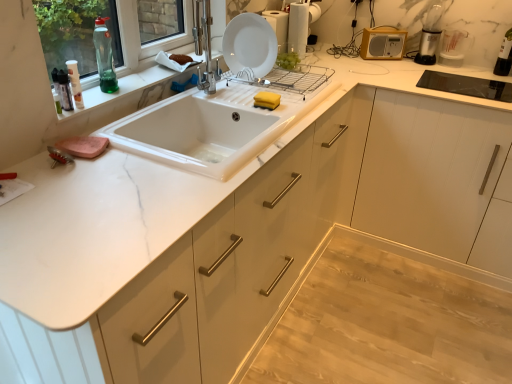
The width and height of the screenshot is (512, 384). Identify the location of free spot behind translucent plastic spray bottle at upper left, marked as the third bottle in a back-to-front arrangement. (97, 92).